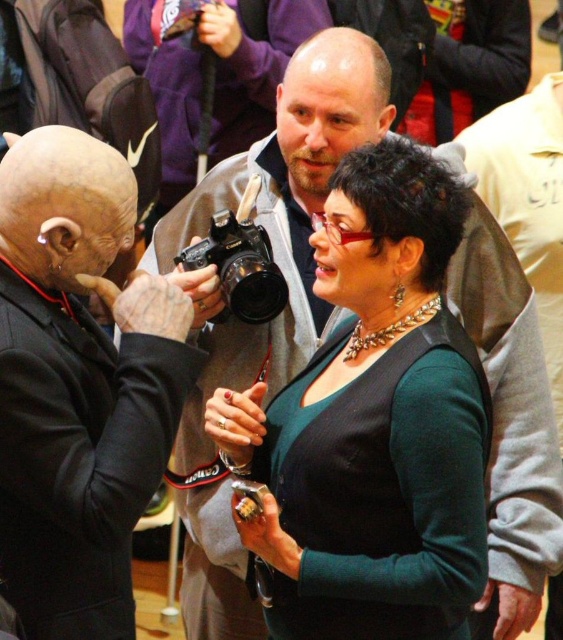
You are a photographer trying to capture a candid shot of the scene. The green matte dress at center and the black plastic camera at center are both in your frame. Since you want to ensure the dress is the focal point, which object should you adjust your focus to prioritize based on their sizes?

The green matte dress at center is wider than the black plastic camera at center, so focusing on the dress would naturally draw attention to it as it occupies more space in the frame.

You are a photographer at a fashion show and need to capture the model wearing the green matte dress at center and the model wearing the black matte suit at left. Which model should you focus on first if you want to photograph the larger one?

The green matte dress at center is bigger than the black matte suit at left, so you should focus on the model wearing the green matte dress at center first.